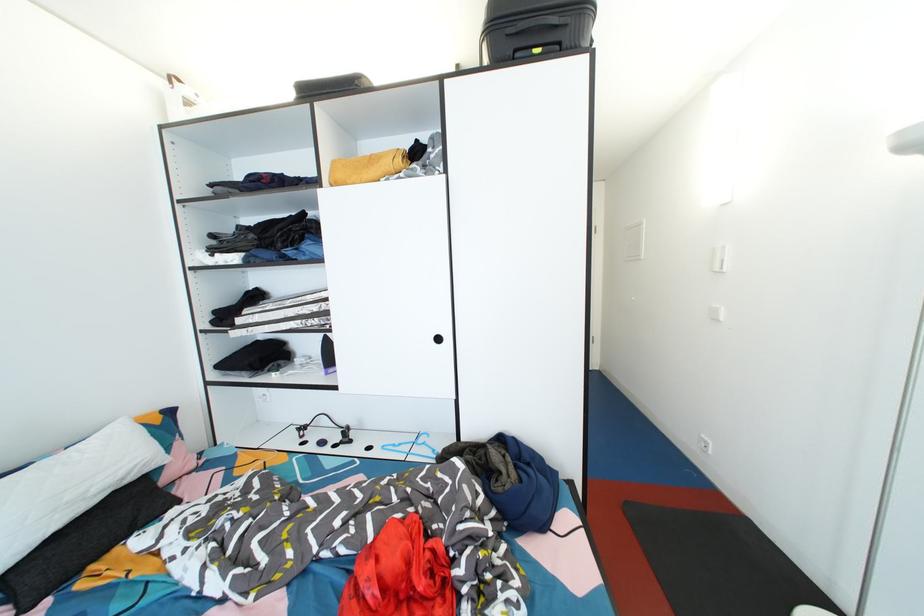
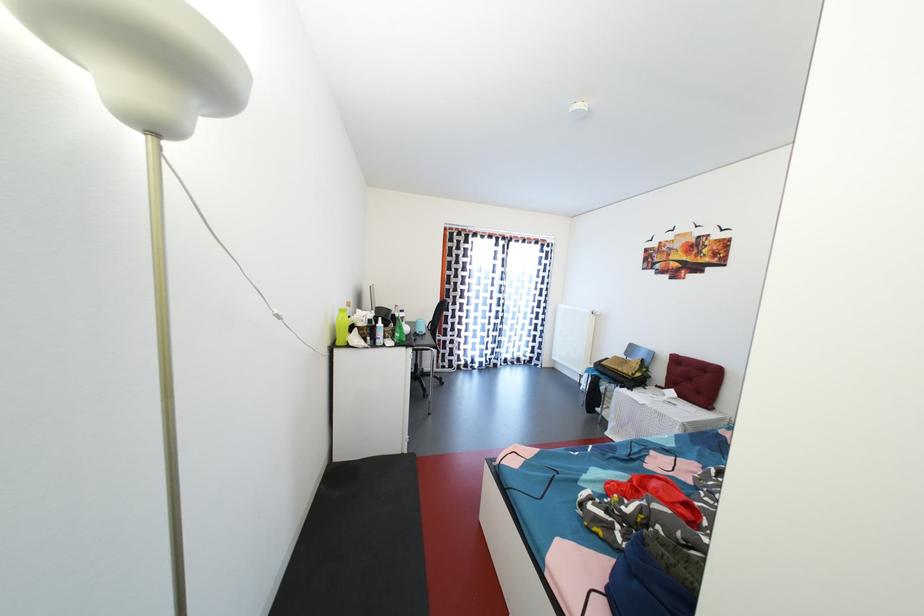
Question: I am providing you with two images of the same scene from different viewpoints. Please identify which objects are invisible in image2.

Choices:
 (A) lime green bottle
 (B) green backpack
 (C) small juice bottle
 (D) black pillow

Answer: (D)